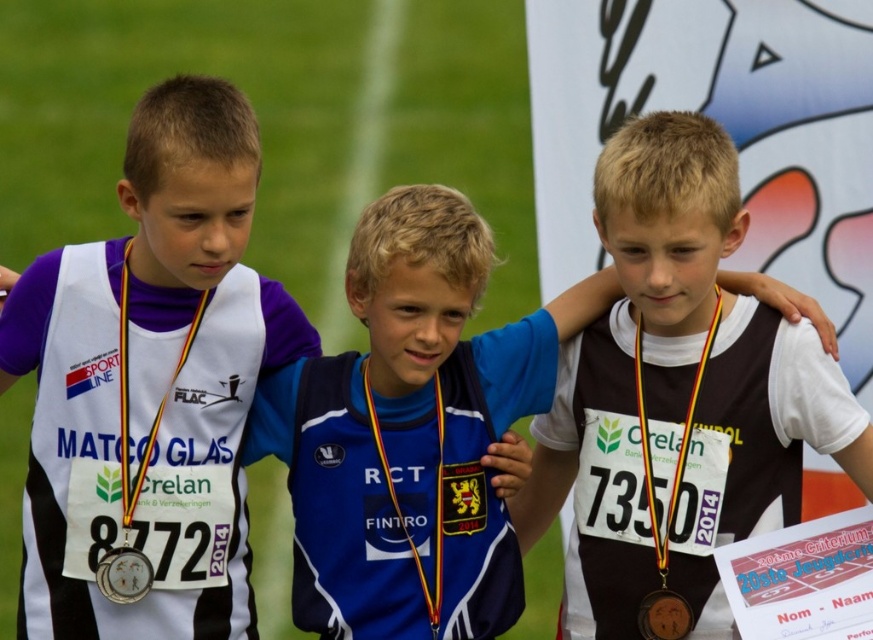
Does matte black vest at left appear on the right side of gold metallic medal at center?

In fact, matte black vest at left is to the left of gold metallic medal at center.

Is point (227, 426) farther from camera compared to point (650, 600)?

Yes, it is.

I want to click on matte black vest at left, so click(150, 385).

Who is positioned more to the right, matte black vest at left or brown fabric shirt at center?

From the viewer's perspective, brown fabric shirt at center appears more on the right side.

Is matte black vest at left smaller than brown fabric shirt at center?

Indeed, matte black vest at left has a smaller size compared to brown fabric shirt at center.

I want to click on matte black vest at left, so click(x=150, y=385).

Find the location of a particular element. The height and width of the screenshot is (640, 873). matte black vest at left is located at coordinates (150, 385).

Can you confirm if matte black vest at left is positioned to the right of white matte neck at center?

Incorrect, matte black vest at left is not on the right side of white matte neck at center.

At what (x,y) coordinates should I click in order to perform the action: click on matte black vest at left. Please return your answer as a coordinate pair (x, y). Looking at the image, I should click on (150, 385).